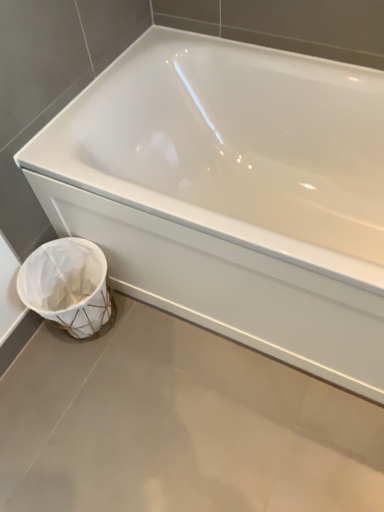
What are the coordinates of `free spot in front of white woven basket at lower left` in the screenshot? It's located at (81, 386).